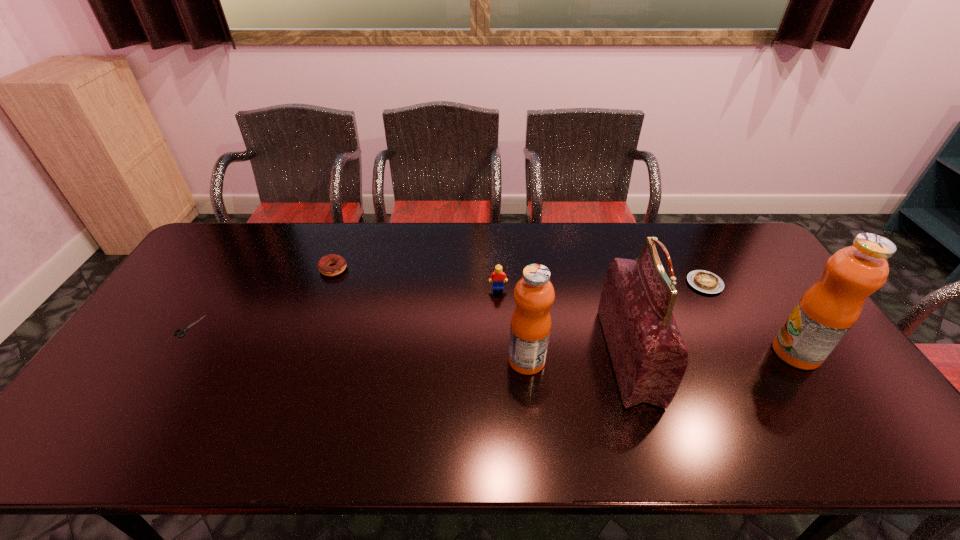
Find the location of a particular element. vacant region located 0.310m on the front-facing side of the fifth object from left to right is located at coordinates (493, 356).

You are a GUI agent. You are given a task and a screenshot of the screen. Output one action in this format:
    pyautogui.click(x=<x>, y=<y>)
    Task: Click on the object positioned at the far edge
    
    Given the screenshot: What is the action you would take?
    pyautogui.click(x=323, y=264)

This screenshot has width=960, height=540. Identify the location of object located in the near edge section of the desktop. pyautogui.click(x=648, y=354).

At what (x,y) coordinates should I click in order to perform the action: click on object situated at the left edge. Please return your answer as a coordinate pair (x, y). The height and width of the screenshot is (540, 960). Looking at the image, I should click on (183, 330).

At what (x,y) coordinates should I click in order to perform the action: click on object at the right edge. Please return your answer as a coordinate pair (x, y). Looking at the image, I should click on (825, 313).

In the image, there is a desktop. In order to click on vacant region at the far edge in this screenshot , I will do `click(582, 258)`.

Find the location of a particular element. Image resolution: width=960 pixels, height=540 pixels. vacant region at the near edge of the desktop is located at coordinates (220, 410).

You are a GUI agent. You are given a task and a screenshot of the screen. Output one action in this format:
    pyautogui.click(x=<x>, y=<y>)
    Task: Click on the vacant area at the left edge of the desktop
    The image size is (960, 540).
    Given the screenshot: What is the action you would take?
    pyautogui.click(x=160, y=354)

Image resolution: width=960 pixels, height=540 pixels. Identify the location of vacant area at the right edge of the desktop. (x=728, y=275).

What are the coordinates of `free location at the far left corner` in the screenshot? It's located at (235, 260).